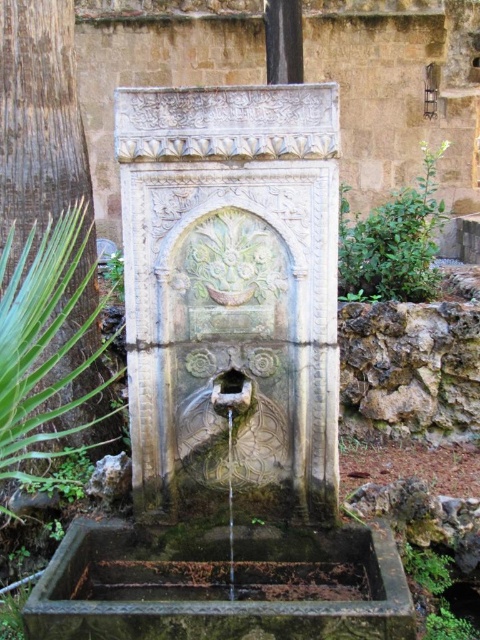
Does carved stone fountain at center lie behind clear glass water at center?

No.

Can you confirm if carved stone fountain at center is wider than clear glass water at center?

Yes, carved stone fountain at center is wider than clear glass water at center.

At what (x,y) coordinates should I click in order to perform the action: click on carved stone fountain at center. Please return your answer as a coordinate pair (x, y). Looking at the image, I should click on (228, 387).

Where is `carved stone fountain at center`? The width and height of the screenshot is (480, 640). carved stone fountain at center is located at coordinates (228, 387).